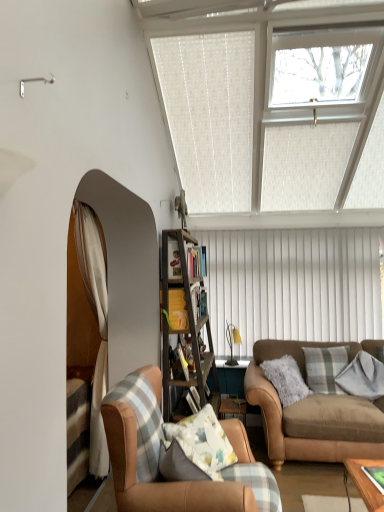
Question: From a real-world perspective, relative to yellow fabric at center, which is the first shelf from front to back, is clear glass window at upper center vertically above or below?

Choices:
 (A) above
 (B) below

Answer: (A)

Question: From the image's perspective, is clear glass window at upper center above or below yellow fabric at center, which is counted as the third shelf, starting from the back?

Choices:
 (A) above
 (B) below

Answer: (A)

Question: Based on their relative distances, which object is nearer to the wooden ladder at center?

Choices:
 (A) gray flannel pillow at right, marked as the 2th pillow in a left-to-right arrangement
 (B) plaid fabric pillow at center right, marked as the 2th pillow in a right-to-left arrangement
 (C) wooden bookshelf at center, which is the third shelf from front to back
 (D) leather armchair at lower left
 (E) matte yellow lamp at center

Answer: (C)

Question: Which object is positioned closest to the plaid fabric pillow at center right, marked as the 2th pillow in a right-to-left arrangement?

Choices:
 (A) brown leather couch at lower right
 (B) yellow fabric at center, which is counted as the third shelf, starting from the back
 (C) leather armchair at lower left
 (D) matte yellow lamp at center
 (E) clear glass window at upper center

Answer: (A)